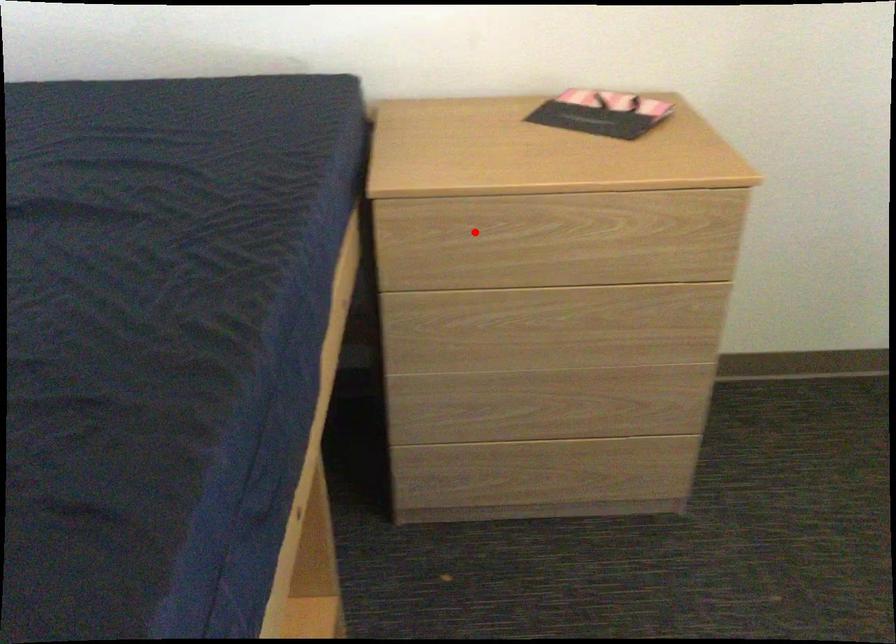
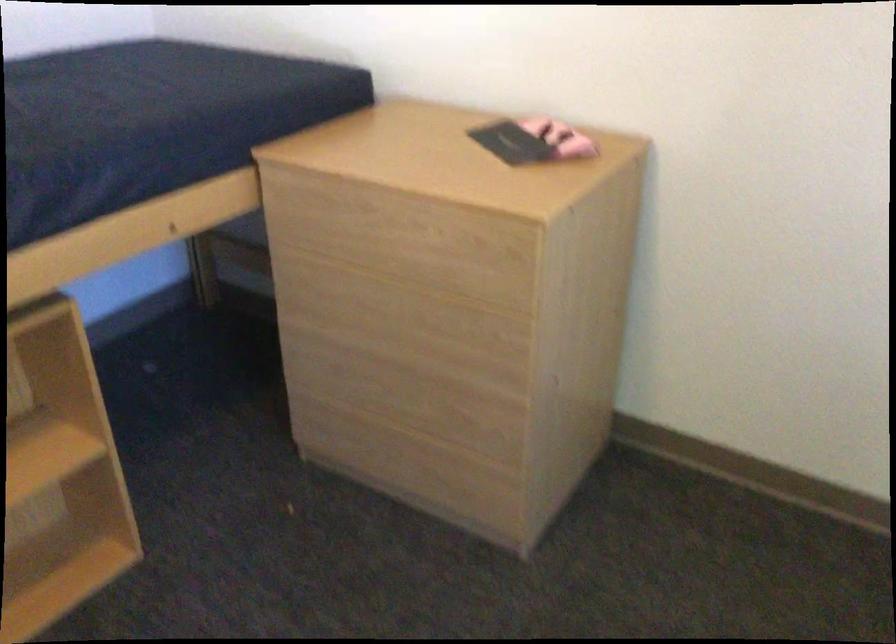
Question: I am providing you with two images of the same scene from different viewpoints. Image1 has a red point marked. In image2, the corresponding 3D location appears at what relative position? Reply with the corresponding letter.

Choices:
 (A) Closer
 (B) Farther

Answer: (B)